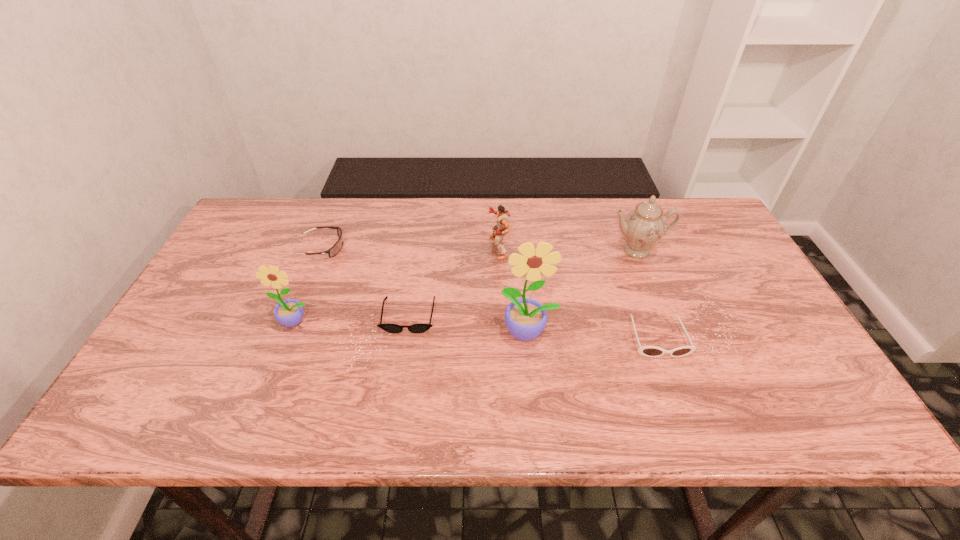
You are a GUI agent. You are given a task and a screenshot of the screen. Output one action in this format:
    pyautogui.click(x=<x>, y=<y>)
    Task: Click on the left sunflower
    This screenshot has height=540, width=960.
    Given the screenshot: What is the action you would take?
    pyautogui.click(x=289, y=313)

The width and height of the screenshot is (960, 540). In order to click on the right sunflower in this screenshot , I will do `click(525, 318)`.

Find the location of `the taller sunflower`. the taller sunflower is located at coordinates (525, 318).

Locate an element on the screen. The image size is (960, 540). chinaware is located at coordinates (644, 226).

The image size is (960, 540). What are the coordinates of `puncher` in the screenshot? It's located at (499, 231).

Locate an element on the screen. goggles is located at coordinates (333, 251).

This screenshot has width=960, height=540. I want to click on the right sunglasses, so tap(649, 351).

Where is `the shortest object`? Image resolution: width=960 pixels, height=540 pixels. the shortest object is located at coordinates (388, 327).

Where is `the third object from left to right`? This screenshot has height=540, width=960. the third object from left to right is located at coordinates (388, 327).

Identify the location of free space located on the front-facing side of the shorter sunflower. (281, 359).